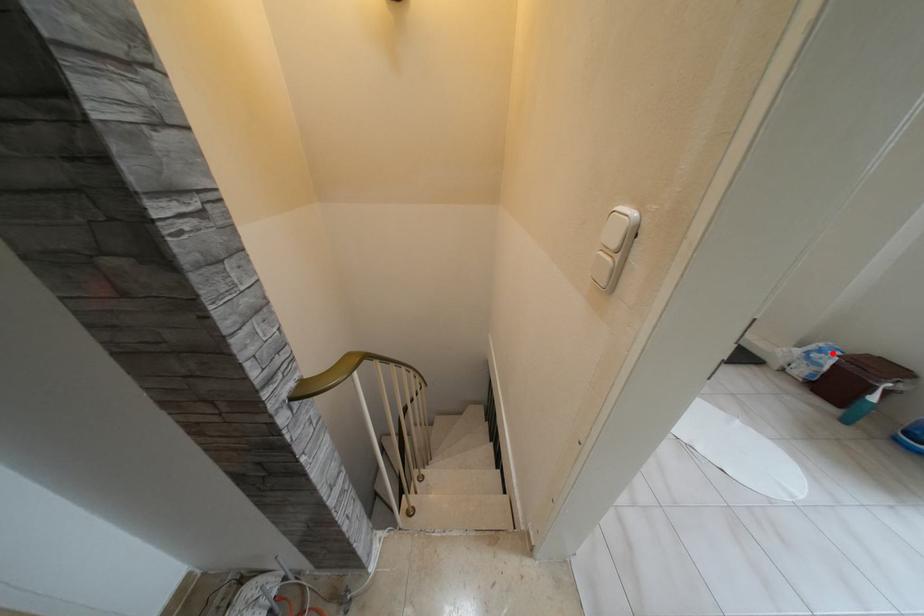
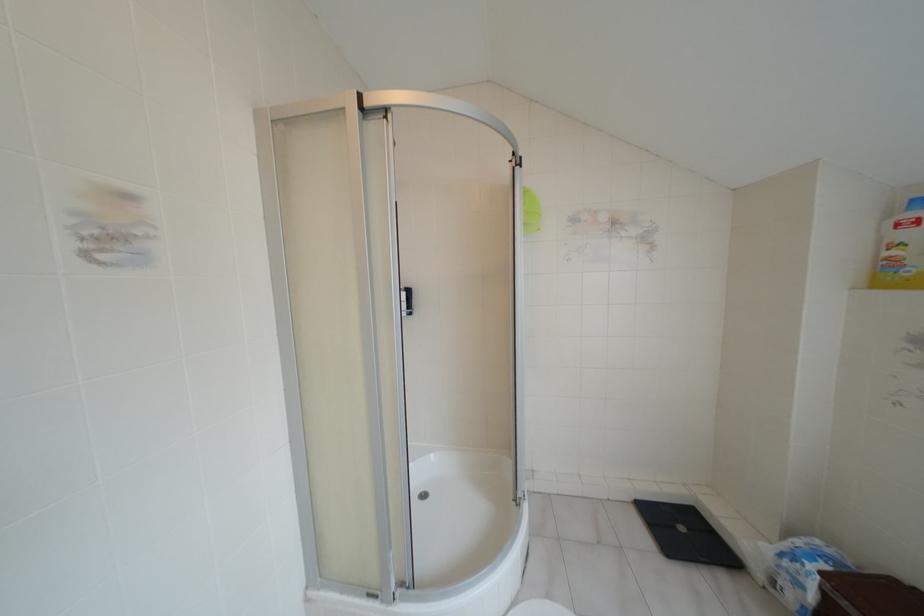
Question: I am providing you with two images of the same scene from different viewpoints. In image1, a red point is highlighted. Considering the same 3D point in image2, which of the following is correct?

Choices:
 (A) It is closer
 (B) It is farther

Answer: (A)